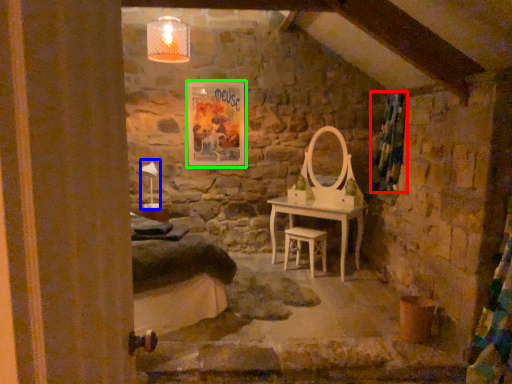
Question: Considering the real-world distances, which object is closest to curtain (highlighted by a red box)? table lamp (highlighted by a blue box) or picture frame (highlighted by a green box).

Choices:
 (A) table lamp
 (B) picture frame

Answer: (B)